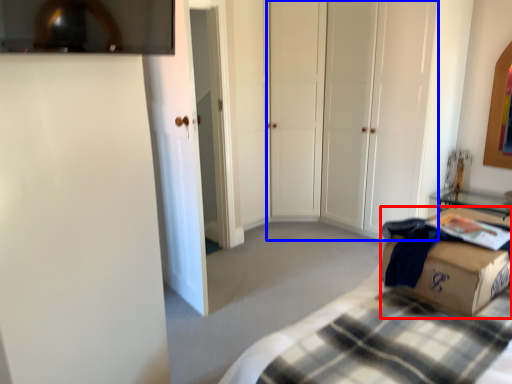
Question: Which of the following is the closest to the observer, box (highlighted by a red box) or glass door (highlighted by a blue box)?

Choices:
 (A) box
 (B) glass door

Answer: (A)